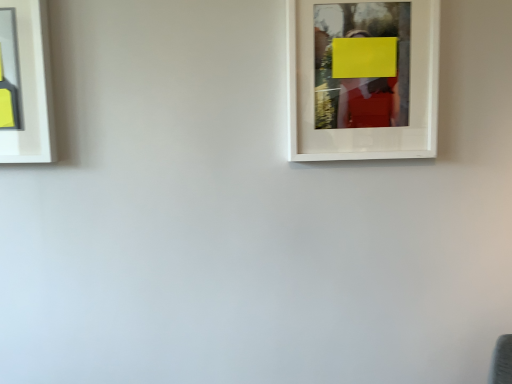
Locate an element on the screen. This screenshot has height=384, width=512. matte gray picture frame at left, which ranks as the second picture frame in right-to-left order is located at coordinates (25, 84).

What is the approximate width of matte gray picture frame at left, which ranks as the second picture frame in right-to-left order?

It is 1.59 inches.

The height and width of the screenshot is (384, 512). What do you see at coordinates (25, 84) in the screenshot?
I see `matte gray picture frame at left, which ranks as the second picture frame in right-to-left order` at bounding box center [25, 84].

What is the approximate width of white matte picture frame at upper right, placed as the 2th picture frame when sorted from left to right?

white matte picture frame at upper right, placed as the 2th picture frame when sorted from left to right, is 5.07 centimeters in width.

This screenshot has width=512, height=384. Find the location of `white matte picture frame at upper right, placed as the 2th picture frame when sorted from left to right`. white matte picture frame at upper right, placed as the 2th picture frame when sorted from left to right is located at coordinates (362, 129).

What is the approximate height of white matte picture frame at upper right, placed as the 2th picture frame when sorted from left to right?

38.84 centimeters.

The height and width of the screenshot is (384, 512). What do you see at coordinates (362, 129) in the screenshot?
I see `white matte picture frame at upper right, placed as the 2th picture frame when sorted from left to right` at bounding box center [362, 129].

In order to click on matte gray picture frame at left, placed as the first picture frame when sorted from left to right in this screenshot , I will do `click(25, 84)`.

Does white matte picture frame at upper right, the 1th picture frame positioned from the right, appear on the right side of matte gray picture frame at left, placed as the first picture frame when sorted from left to right?

Yes, white matte picture frame at upper right, the 1th picture frame positioned from the right, is to the right of matte gray picture frame at left, placed as the first picture frame when sorted from left to right.

Looking at this image, between white matte picture frame at upper right, the 1th picture frame positioned from the right, and matte gray picture frame at left, placed as the first picture frame when sorted from left to right, which one is positioned behind?

matte gray picture frame at left, placed as the first picture frame when sorted from left to right, is more distant.

Which point is more forward, (292, 121) or (23, 5)?

The point (23, 5) is more forward.

From the image's perspective, relative to matte gray picture frame at left, placed as the first picture frame when sorted from left to right, is white matte picture frame at upper right, placed as the 2th picture frame when sorted from left to right, above or below?

Clearly, from the image's perspective, white matte picture frame at upper right, placed as the 2th picture frame when sorted from left to right, is above matte gray picture frame at left, placed as the first picture frame when sorted from left to right.

From a real-world perspective, which is physically above, white matte picture frame at upper right, placed as the 2th picture frame when sorted from left to right, or matte gray picture frame at left, placed as the first picture frame when sorted from left to right?

In real-world perspective, matte gray picture frame at left, placed as the first picture frame when sorted from left to right, is above.

Which object is thinner, white matte picture frame at upper right, placed as the 2th picture frame when sorted from left to right, or matte gray picture frame at left, placed as the first picture frame when sorted from left to right?

matte gray picture frame at left, placed as the first picture frame when sorted from left to right, is thinner.

Based on the photo, which of these two, white matte picture frame at upper right, placed as the 2th picture frame when sorted from left to right, or matte gray picture frame at left, placed as the first picture frame when sorted from left to right, stands taller?

Standing taller between the two is white matte picture frame at upper right, placed as the 2th picture frame when sorted from left to right.

Consider the image. Is white matte picture frame at upper right, the 1th picture frame positioned from the right, bigger or smaller than matte gray picture frame at left, which ranks as the second picture frame in right-to-left order?

In the image, white matte picture frame at upper right, the 1th picture frame positioned from the right, appears to be larger than matte gray picture frame at left, which ranks as the second picture frame in right-to-left order.

Is white matte picture frame at upper right, placed as the 2th picture frame when sorted from left to right, outside of matte gray picture frame at left, which ranks as the second picture frame in right-to-left order?

white matte picture frame at upper right, placed as the 2th picture frame when sorted from left to right, is positioned outside matte gray picture frame at left, which ranks as the second picture frame in right-to-left order.

Is white matte picture frame at upper right, the 1th picture frame positioned from the right, next to matte gray picture frame at left, placed as the first picture frame when sorted from left to right, and touching it?

There is a gap between white matte picture frame at upper right, the 1th picture frame positioned from the right, and matte gray picture frame at left, placed as the first picture frame when sorted from left to right.

From the picture: Could you tell me if white matte picture frame at upper right, placed as the 2th picture frame when sorted from left to right, is facing matte gray picture frame at left, which ranks as the second picture frame in right-to-left order?

No, white matte picture frame at upper right, placed as the 2th picture frame when sorted from left to right, is not turned towards matte gray picture frame at left, which ranks as the second picture frame in right-to-left order.

Can you tell me how much white matte picture frame at upper right, placed as the 2th picture frame when sorted from left to right, and matte gray picture frame at left, which ranks as the second picture frame in right-to-left order, differ in facing direction?

0.0072 degrees.

Find the location of a particular element. Image resolution: width=512 pixels, height=384 pixels. picture frame behind the white matte picture frame at upper right, placed as the 2th picture frame when sorted from left to right is located at coordinates (25, 84).

Between matte gray picture frame at left, placed as the first picture frame when sorted from left to right, and white matte picture frame at upper right, placed as the 2th picture frame when sorted from left to right, which one appears on the right side from the viewer's perspective?

white matte picture frame at upper right, placed as the 2th picture frame when sorted from left to right.

Who is more distant, matte gray picture frame at left, placed as the first picture frame when sorted from left to right, or white matte picture frame at upper right, the 1th picture frame positioned from the right?

Positioned behind is matte gray picture frame at left, placed as the first picture frame when sorted from left to right.

Which is more distant, (21, 40) or (296, 96)?

Point (296, 96)

From the image's perspective, who appears lower, matte gray picture frame at left, placed as the first picture frame when sorted from left to right, or white matte picture frame at upper right, placed as the 2th picture frame when sorted from left to right?

From the image's view, matte gray picture frame at left, placed as the first picture frame when sorted from left to right, is below.

From a real-world perspective, relative to white matte picture frame at upper right, placed as the 2th picture frame when sorted from left to right, is matte gray picture frame at left, placed as the first picture frame when sorted from left to right, vertically above or below?

From a real-world perspective, matte gray picture frame at left, placed as the first picture frame when sorted from left to right, is physically above white matte picture frame at upper right, placed as the 2th picture frame when sorted from left to right.

Considering the relative sizes of matte gray picture frame at left, which ranks as the second picture frame in right-to-left order, and white matte picture frame at upper right, placed as the 2th picture frame when sorted from left to right, in the image provided, is matte gray picture frame at left, which ranks as the second picture frame in right-to-left order, wider than white matte picture frame at upper right, placed as the 2th picture frame when sorted from left to right,?

No, matte gray picture frame at left, which ranks as the second picture frame in right-to-left order, is not wider than white matte picture frame at upper right, placed as the 2th picture frame when sorted from left to right.

Can you confirm if matte gray picture frame at left, which ranks as the second picture frame in right-to-left order, is taller than white matte picture frame at upper right, placed as the 2th picture frame when sorted from left to right?

No, matte gray picture frame at left, which ranks as the second picture frame in right-to-left order, is not taller than white matte picture frame at upper right, placed as the 2th picture frame when sorted from left to right.

Who is smaller, matte gray picture frame at left, which ranks as the second picture frame in right-to-left order, or white matte picture frame at upper right, placed as the 2th picture frame when sorted from left to right?

matte gray picture frame at left, which ranks as the second picture frame in right-to-left order.

Choose the correct answer: Is matte gray picture frame at left, placed as the first picture frame when sorted from left to right, inside white matte picture frame at upper right, placed as the 2th picture frame when sorted from left to right, or outside it?

matte gray picture frame at left, placed as the first picture frame when sorted from left to right, is spatially situated outside white matte picture frame at upper right, placed as the 2th picture frame when sorted from left to right.

Is matte gray picture frame at left, placed as the first picture frame when sorted from left to right, directly adjacent to white matte picture frame at upper right, the 1th picture frame positioned from the right?

No, matte gray picture frame at left, placed as the first picture frame when sorted from left to right, is not making contact with white matte picture frame at upper right, the 1th picture frame positioned from the right.

Is white matte picture frame at upper right, the 1th picture frame positioned from the right, at the back of matte gray picture frame at left, which ranks as the second picture frame in right-to-left order?

No, white matte picture frame at upper right, the 1th picture frame positioned from the right, is not at the back of matte gray picture frame at left, which ranks as the second picture frame in right-to-left order.

How different are the orientations of matte gray picture frame at left, which ranks as the second picture frame in right-to-left order, and white matte picture frame at upper right, placed as the 2th picture frame when sorted from left to right, in degrees?

0.0072 degrees separate the facing orientations of matte gray picture frame at left, which ranks as the second picture frame in right-to-left order, and white matte picture frame at upper right, placed as the 2th picture frame when sorted from left to right.

Find the location of a particular element. The width and height of the screenshot is (512, 384). picture frame that is on the left side of white matte picture frame at upper right, the 1th picture frame positioned from the right is located at coordinates (25, 84).

Find the location of a particular element. picture frame in front of the matte gray picture frame at left, placed as the first picture frame when sorted from left to right is located at coordinates (362, 129).

This screenshot has height=384, width=512. In order to click on picture frame that appears above the white matte picture frame at upper right, the 1th picture frame positioned from the right (from a real-world perspective) in this screenshot , I will do `click(25, 84)`.